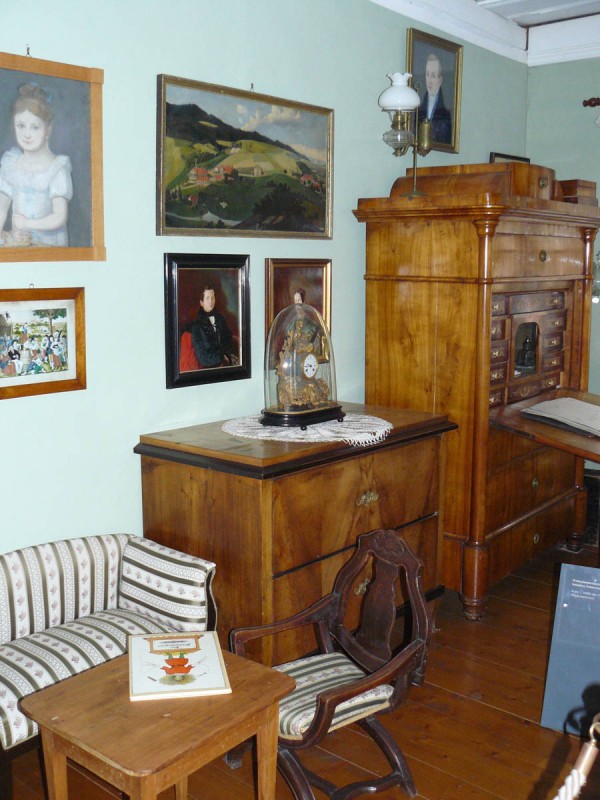
Locate an element on the screen. The height and width of the screenshot is (800, 600). book is located at coordinates (198, 654).